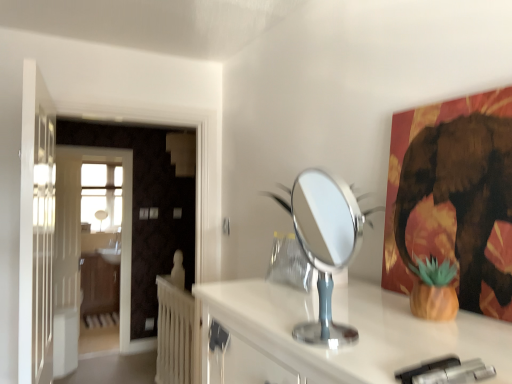
What is the approximate height of silver metallic mirror at center?

It is 12.59 inches.

The width and height of the screenshot is (512, 384). Identify the location of metallic gold elephant at upper right. (463, 192).

Identify the location of sink located below the white wooden door at left, which is the second door from back to front (from the image's perspective). (110, 255).

Do you think white wooden door at left, acting as the first door starting from the front, is within white glossy sink at center, or outside of it?

white wooden door at left, acting as the first door starting from the front, is outside white glossy sink at center.

Is white wooden door at left, which ranks as the second door in left-to-right order, thinner than white glossy sink at center?

Yes, white wooden door at left, which ranks as the second door in left-to-right order, is thinner than white glossy sink at center.

Considering the relative sizes of white wooden door at left, which is the second door from back to front, and white glossy sink at center in the image provided, is white wooden door at left, which is the second door from back to front, shorter than white glossy sink at center?

Incorrect, the height of white wooden door at left, which is the second door from back to front, does not fall short of that of white glossy sink at center.

Which of these two, wooden dresser at left or metallic gold elephant at upper right, is bigger?

wooden dresser at left is bigger.

Measure the distance from wooden dresser at left to metallic gold elephant at upper right.

The distance of wooden dresser at left from metallic gold elephant at upper right is 5.09 meters.

Is wooden dresser at left positioned beyond the bounds of metallic gold elephant at upper right?

Yes.

Is wooden dresser at left wider than metallic gold elephant at upper right?

Yes.

Which object is thinner, white wooden door at left, which ranks as the second door in right-to-left order, or wooden dresser at left?

Thinner between the two is white wooden door at left, which ranks as the second door in right-to-left order.

From the image's perspective, is white wooden door at left, which ranks as the second door in right-to-left order, below wooden dresser at left?

No, from the image's perspective, white wooden door at left, which ranks as the second door in right-to-left order, is not below wooden dresser at left.

Consider the image. Considering the sizes of objects white wooden door at left, which ranks as the second door in right-to-left order, and wooden dresser at left in the image provided, who is smaller, white wooden door at left, which ranks as the second door in right-to-left order, or wooden dresser at left?

Smaller between the two is white wooden door at left, which ranks as the second door in right-to-left order.

Based on the photo, is white wooden door at left, the 1th door when ordered from left to right, behind wooden dresser at left?

No.

From a real-world perspective, is wooden dresser at left under white glossy sink at center?

Yes, from a real-world perspective, wooden dresser at left is under white glossy sink at center.

Measure the distance from wooden dresser at left to white glossy sink at center.

wooden dresser at left is 12.77 inches from white glossy sink at center.

Identify the location of sink lying above the wooden dresser at left (from the image's perspective). This screenshot has width=512, height=384. (110, 255).

Which object is further away from the camera, wooden dresser at left or white glossy sink at center?

white glossy sink at center is more distant.

Can you see silver metallic mirror at center touching white wooden door at left, the 1th door when ordered from back to front?

No, silver metallic mirror at center is not next to white wooden door at left, the 1th door when ordered from back to front.

Is point (296, 199) closer to viewer compared to point (53, 368)?

Yes, point (296, 199) is in front of point (53, 368).

Which of these two, silver metallic mirror at center or white wooden door at left, which ranks as the second door in right-to-left order, stands shorter?

silver metallic mirror at center.

Is silver metallic mirror at center completely or partially outside of white wooden door at left, which is the 2th door in front-to-back order?

Yes, silver metallic mirror at center is outside of white wooden door at left, which is the 2th door in front-to-back order.

From a real-world perspective, which object stands above the other?

metallic gold elephant at upper right is physically above.

How much distance is there between metallic gold elephant at upper right and wooden dresser at left?

metallic gold elephant at upper right is 16.70 feet away from wooden dresser at left.

Considering the points (499, 277) and (109, 266), which point is in front, point (499, 277) or point (109, 266)?

The point (499, 277) is in front.

From the picture: Is metallic gold elephant at upper right turned away from wooden dresser at left?

No, metallic gold elephant at upper right's orientation is not away from wooden dresser at left.

Looking at this image, is white glossy sink at center directly adjacent to white wooden door at left, acting as the first door starting from the front?

No, white glossy sink at center is not with white wooden door at left, acting as the first door starting from the front.

From their relative heights in the image, would you say white glossy sink at center is taller or shorter than white wooden door at left, which is the 1th door from right to left?

Considering their sizes, white glossy sink at center has less height than white wooden door at left, which is the 1th door from right to left.

Is white glossy sink at center oriented away from white wooden door at left, which ranks as the second door in left-to-right order?

No.

Where is `sink located underneath the white wooden door at left, which is the 1th door from right to left (from a real-world perspective)`? Image resolution: width=512 pixels, height=384 pixels. sink located underneath the white wooden door at left, which is the 1th door from right to left (from a real-world perspective) is located at coordinates (110, 255).

You are a GUI agent. You are given a task and a screenshot of the screen. Output one action in this format:
    pyautogui.click(x=<x>, y=<y>)
    Task: Click on the dresser on the left of metallic gold elephant at upper right
    This screenshot has height=384, width=512.
    Given the screenshot: What is the action you would take?
    pyautogui.click(x=99, y=285)

Considering their positions, is white wooden door at left, which is the second door from back to front, positioned further to white wooden door at left, the 1th door when ordered from back to front, than metallic gold elephant at upper right?

Among the two, metallic gold elephant at upper right is located further to white wooden door at left, the 1th door when ordered from back to front.

Looking at the image, which one is located further to white wooden door at left, which ranks as the second door in right-to-left order, white wooden door at left, acting as the first door starting from the front, or silver metallic mirror at center?

silver metallic mirror at center is positioned further to the anchor white wooden door at left, which ranks as the second door in right-to-left order.

Looking at the image, which one is located further to white glossy sink at center, wooden dresser at left or silver metallic mirror at center?

silver metallic mirror at center.

From the image, which object appears to be farther from wooden dresser at left, white wooden door at left, which is the second door from back to front, or silver metallic mirror at center?

The object further to wooden dresser at left is silver metallic mirror at center.

Based on their spatial positions, is white wooden door at left, the 1th door when ordered from left to right, or wooden dresser at left closer to white glossy sink at center?

wooden dresser at left is positioned closer to the anchor white glossy sink at center.

Which object lies nearer to the anchor point white wooden door at left, which ranks as the second door in left-to-right order, wooden dresser at left or silver metallic mirror at center?

Among the two, wooden dresser at left is located nearer to white wooden door at left, which ranks as the second door in left-to-right order.

Looking at the image, which one is located further to white wooden door at left, which ranks as the second door in left-to-right order, white glossy sink at center or white wooden door at left, which is the 2th door in front-to-back order?

white glossy sink at center lies further to white wooden door at left, which ranks as the second door in left-to-right order, than the other object.

Looking at the image, which one is located further to metallic gold elephant at upper right, wooden dresser at left or white wooden door at left, acting as the first door starting from the front?

The object further to metallic gold elephant at upper right is wooden dresser at left.

Find the location of a particular element. dresser between white wooden door at left, which is the 2th door in front-to-back order, and white glossy sink at center from front to back is located at coordinates (99, 285).

You are a GUI agent. You are given a task and a screenshot of the screen. Output one action in this format:
    pyautogui.click(x=<x>, y=<y>)
    Task: Click on the dresser positioned between metallic gold elephant at upper right and white glossy sink at center from near to far
    This screenshot has height=384, width=512.
    Given the screenshot: What is the action you would take?
    pyautogui.click(x=99, y=285)

Where is `elephant between silver metallic mirror at center and white wooden door at left, the 1th door when ordered from left to right, in the front-back direction`? This screenshot has height=384, width=512. elephant between silver metallic mirror at center and white wooden door at left, the 1th door when ordered from left to right, in the front-back direction is located at coordinates coord(463,192).

The height and width of the screenshot is (384, 512). I want to click on door between white wooden door at left, which is the 1th door from right to left, and white glossy sink at center in the front-back direction, so click(66, 265).